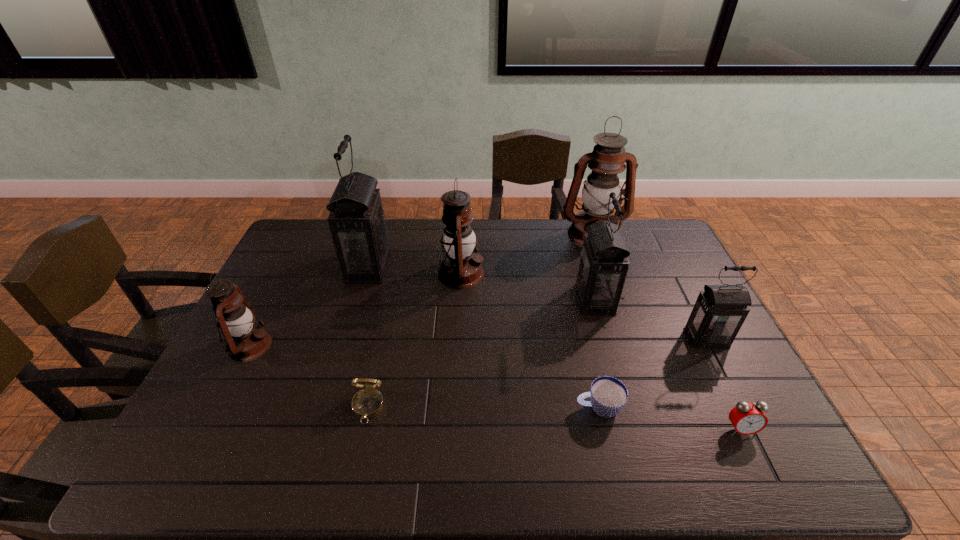
Locate an element on the screen. vacant space that satisfies the following two spatial constraints: 1. on the front-facing side of the second gray lantern from right to left; 2. with the dial facing the compass is located at coordinates (625, 407).